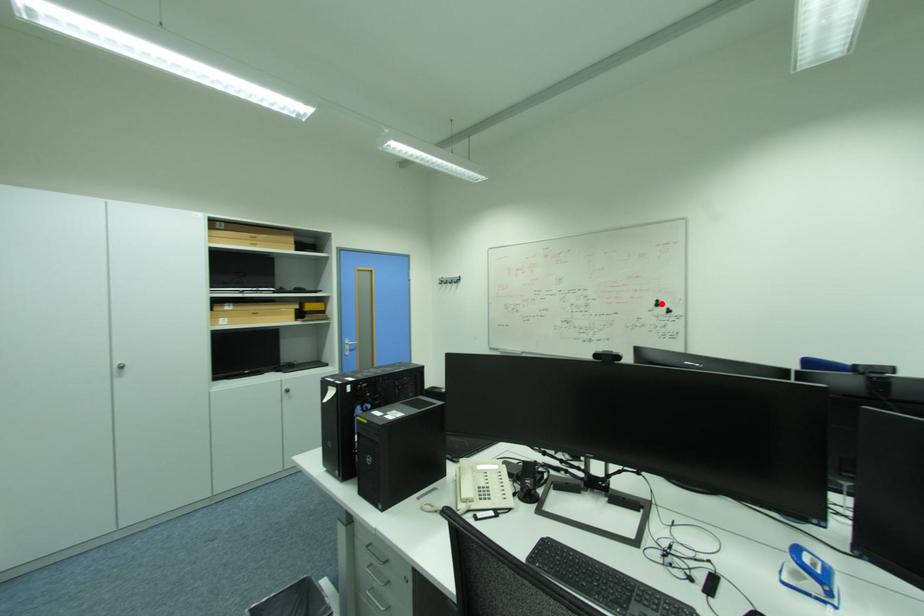
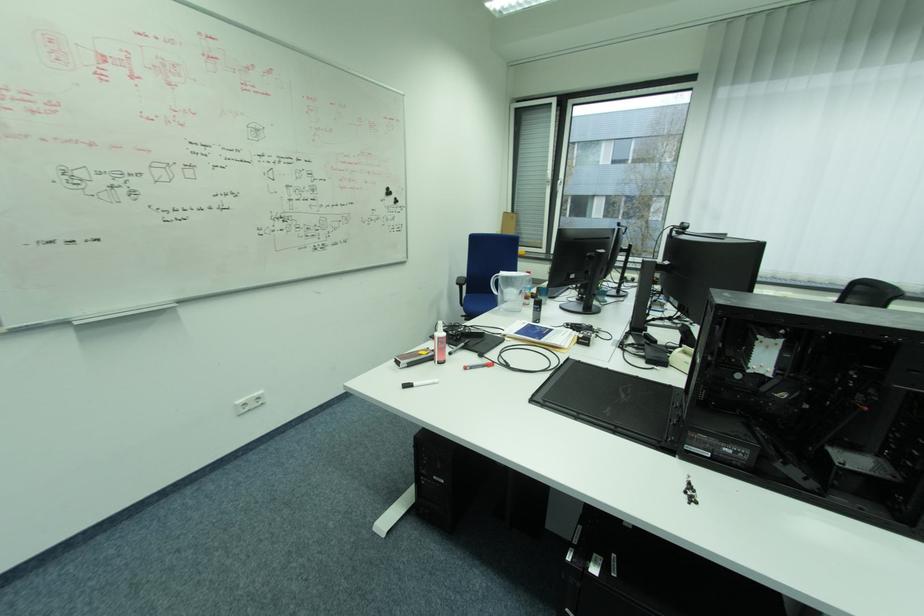
Question: I am providing you with two images of the same scene from different viewpoints. Image1 has a red point marked. In image2, the corresponding 3D location appears at what relative position? Reply with the corresponding letter.

Choices:
 (A) Closer
 (B) Farther

Answer: (A)